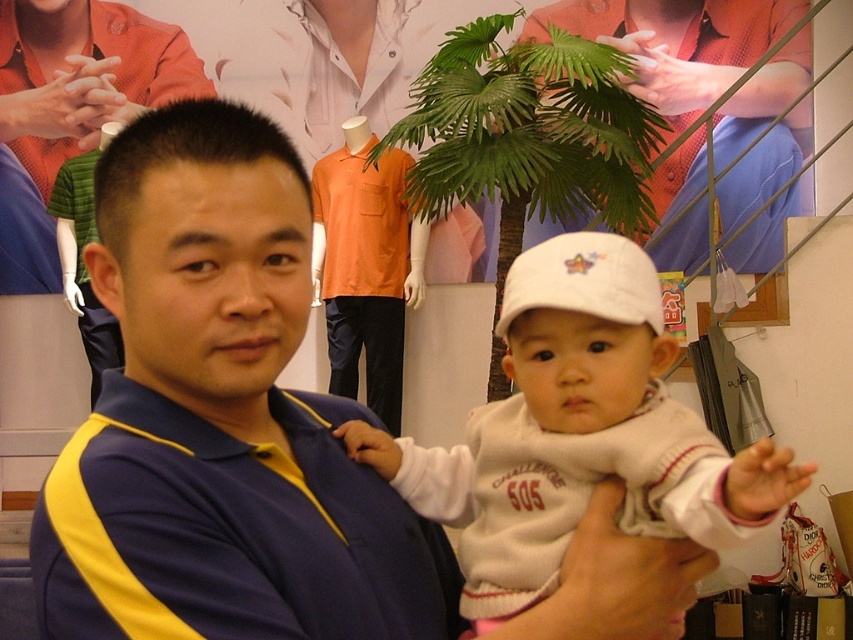
You are a customer in a clothing store and see the white fleece sweater at center and the green leafy plant at upper center. Which object is taller?

The green leafy plant at upper center is taller than the white fleece sweater at center.